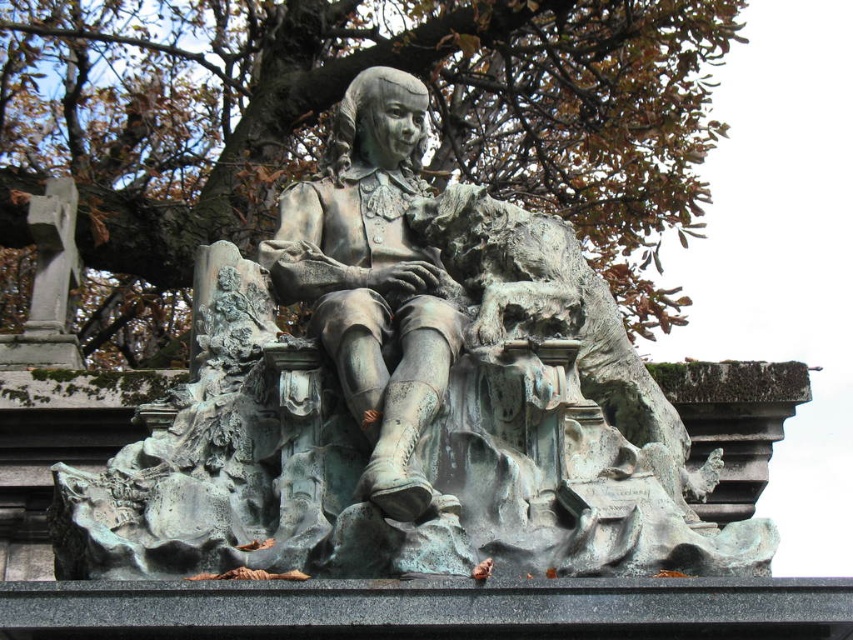
You are an art conservator examining the sculpture. You notice two statues at the center of the image. Which one is taller between the green patina statue at center and the bronze statue at center?

The green patina statue at center is much taller than the bronze statue at center.